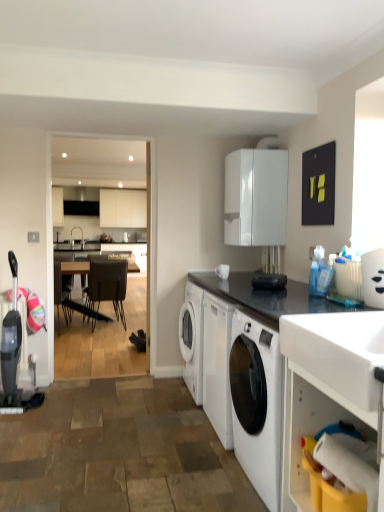
Question: Considering the relative sizes of dark brown leather chair at center, the first chair when ordered from left to right, and leather-like dark brown chair at center, the second chair in the left-to-right sequence, in the image provided, is dark brown leather chair at center, the first chair when ordered from left to right, smaller than leather-like dark brown chair at center, the second chair in the left-to-right sequence,?

Choices:
 (A) yes
 (B) no

Answer: (A)

Question: Are dark brown leather chair at center, which is the 2th chair in right-to-left order, and leather-like dark brown chair at center, which ranks as the 1th chair in front-to-back order, located far from each other?

Choices:
 (A) yes
 (B) no

Answer: (B)

Question: Is leather-like dark brown chair at center, which ranks as the 1th chair in front-to-back order, at the back of dark brown leather chair at center, which is the 2th chair in right-to-left order?

Choices:
 (A) yes
 (B) no

Answer: (B)

Question: Does dark brown leather chair at center, placed as the 2th chair when sorted from front to back, have a greater width compared to leather-like dark brown chair at center, which ranks as the 1th chair in front-to-back order?

Choices:
 (A) no
 (B) yes

Answer: (A)

Question: Is dark brown leather chair at center, the first chair when ordered from left to right, next to leather-like dark brown chair at center, arranged as the second chair when viewed from the back, and touching it?

Choices:
 (A) no
 (B) yes

Answer: (A)

Question: In terms of height, does white glossy sink at upper right look taller or shorter compared to black granite countertop at center, arranged as the 1th countertop when viewed from the top?

Choices:
 (A) short
 (B) tall

Answer: (B)

Question: Considering their positions, is white glossy sink at upper right located in front of or behind black granite countertop at center, acting as the 2th countertop starting from the bottom?

Choices:
 (A) behind
 (B) front

Answer: (B)

Question: Would you say white glossy sink at upper right is inside or outside black granite countertop at center, acting as the 2th countertop starting from the bottom?

Choices:
 (A) outside
 (B) inside

Answer: (A)

Question: From a real-world perspective, relative to black granite countertop at center, arranged as the 1th countertop when viewed from the top, is white glossy sink at upper right vertically above or below?

Choices:
 (A) above
 (B) below

Answer: (B)

Question: From a real-world perspective, is white glossy countertop at lower right, the 1th countertop in the bottom-to-top sequence, positioned above or below white glossy container at upper right?

Choices:
 (A) above
 (B) below

Answer: (B)

Question: From their relative heights in the image, would you say white glossy countertop at lower right, the 2th countertop viewed from the top, is taller or shorter than white glossy container at upper right?

Choices:
 (A) short
 (B) tall

Answer: (B)

Question: In the image, is white glossy countertop at lower right, the 1th countertop in the bottom-to-top sequence, positioned in front of or behind white glossy container at upper right?

Choices:
 (A) front
 (B) behind

Answer: (A)

Question: Is white glossy countertop at lower right, the 1th countertop in the bottom-to-top sequence, situated inside white glossy container at upper right or outside?

Choices:
 (A) outside
 (B) inside

Answer: (A)

Question: Is white glossy container at upper right spatially inside dark brown leather chair at center, placed as the 2th chair when sorted from front to back, or outside of it?

Choices:
 (A) outside
 (B) inside

Answer: (A)

Question: Relative to dark brown leather chair at center, which is the 2th chair in right-to-left order, is white glossy container at upper right in front or behind?

Choices:
 (A) front
 (B) behind

Answer: (A)